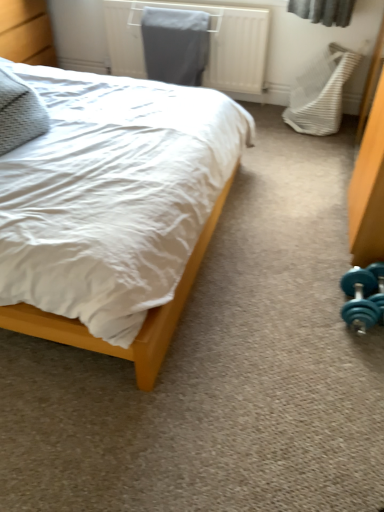
Locate an element on the screen. blank space to the left of teal rubber dumbbell at lower right is located at coordinates (299, 307).